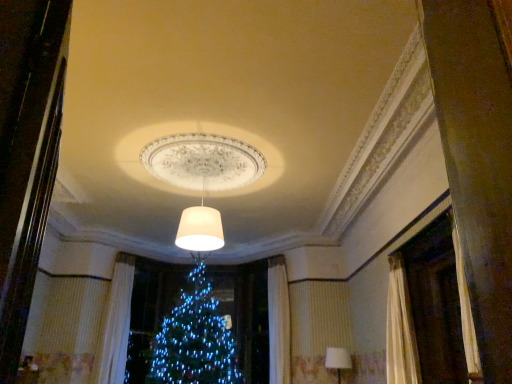
Question: Is white matte lampshade at center, placed as the 1th lamp when sorted from front to back, located outside white fabric lampshade at lower right, marked as the 2th lamp in a front-to-back arrangement?

Choices:
 (A) no
 (B) yes

Answer: (B)

Question: Is white matte lampshade at center, the second lamp viewed from the right, bigger than white fabric lampshade at lower right, marked as the 1th lamp in a bottom-to-top arrangement?

Choices:
 (A) no
 (B) yes

Answer: (B)

Question: From a real-world perspective, is white matte lampshade at center, positioned as the second lamp in back-to-front order, under white fabric lampshade at lower right, marked as the 1th lamp in a bottom-to-top arrangement?

Choices:
 (A) yes
 (B) no

Answer: (B)

Question: Is white matte lampshade at center, the second lamp viewed from the right, wider than white fabric lampshade at lower right, positioned as the 2th lamp in top-to-bottom order?

Choices:
 (A) yes
 (B) no

Answer: (A)

Question: Is white matte lampshade at center, positioned as the 1th lamp in top-to-bottom order, positioned far away from white fabric lampshade at lower right, which appears as the first lamp when viewed from the back?

Choices:
 (A) yes
 (B) no

Answer: (A)

Question: Considering the positions of white fabric lampshade at lower right, marked as the 1th lamp in a bottom-to-top arrangement, and white textured curtain at left in the image, is white fabric lampshade at lower right, marked as the 1th lamp in a bottom-to-top arrangement, bigger or smaller than white textured curtain at left?

Choices:
 (A) small
 (B) big

Answer: (A)

Question: From the image's perspective, is white fabric lampshade at lower right, the second lamp in the left-to-right sequence, above or below white textured curtain at left?

Choices:
 (A) below
 (B) above

Answer: (A)

Question: Visually, is white fabric lampshade at lower right, which appears as the first lamp when viewed from the back, positioned to the left or to the right of white textured curtain at left?

Choices:
 (A) right
 (B) left

Answer: (A)

Question: Relative to white textured curtain at left, is white fabric lampshade at lower right, the second lamp in the left-to-right sequence, in front or behind?

Choices:
 (A) front
 (B) behind

Answer: (A)

Question: Based on their positions, is white textured curtain at left located to the left or right of white matte lampshade at center, positioned as the 1th lamp in top-to-bottom order?

Choices:
 (A) right
 (B) left

Answer: (B)

Question: Considering the positions of white textured curtain at left and white matte lampshade at center, positioned as the 1th lamp in top-to-bottom order, in the image, is white textured curtain at left wider or thinner than white matte lampshade at center, positioned as the 1th lamp in top-to-bottom order,?

Choices:
 (A) thin
 (B) wide

Answer: (A)

Question: From a real-world perspective, relative to white matte lampshade at center, positioned as the second lamp in back-to-front order, is white textured curtain at left vertically above or below?

Choices:
 (A) above
 (B) below

Answer: (B)

Question: In terms of size, does white textured curtain at left appear bigger or smaller than white matte lampshade at center, marked as the 2th lamp in a bottom-to-top arrangement?

Choices:
 (A) big
 (B) small

Answer: (A)

Question: Is point (333, 357) closer or farther from the camera than point (183, 233)?

Choices:
 (A) farther
 (B) closer

Answer: (A)

Question: Considering the positions of white fabric lampshade at lower right, marked as the 1th lamp in a bottom-to-top arrangement, and white matte lampshade at center, the second lamp viewed from the right, in the image, is white fabric lampshade at lower right, marked as the 1th lamp in a bottom-to-top arrangement, taller or shorter than white matte lampshade at center, the second lamp viewed from the right,?

Choices:
 (A) short
 (B) tall

Answer: (A)